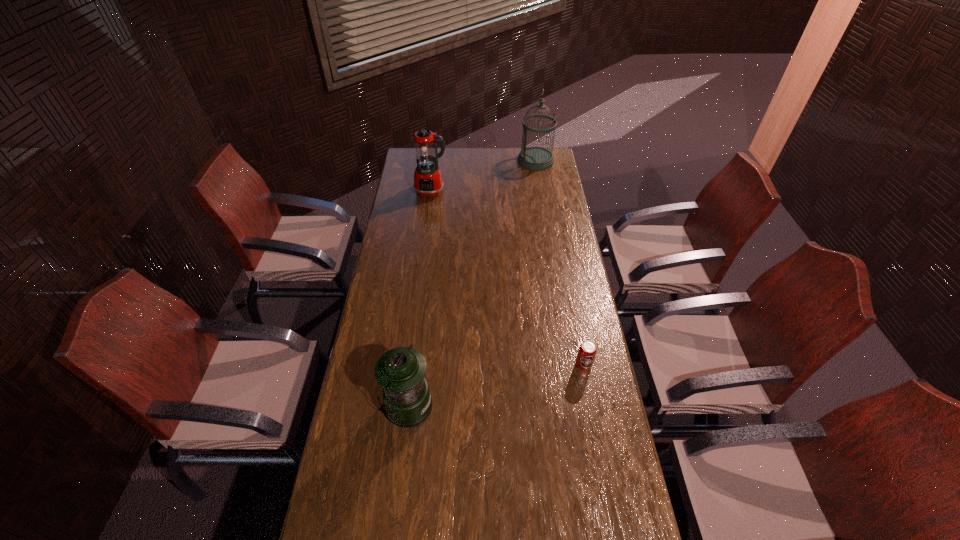
Where is `the farthest object`? The width and height of the screenshot is (960, 540). the farthest object is located at coordinates (534, 158).

Locate an element on the screen. Image resolution: width=960 pixels, height=540 pixels. the tallest object is located at coordinates (534, 158).

Locate an element on the screen. The height and width of the screenshot is (540, 960). the second tallest object is located at coordinates (428, 182).

Where is `food processor`? The width and height of the screenshot is (960, 540). food processor is located at coordinates (428, 182).

Where is `the second shortest object`? The height and width of the screenshot is (540, 960). the second shortest object is located at coordinates (401, 371).

In order to click on lantern in this screenshot , I will do `click(401, 371)`.

Identify the location of soda. point(587,350).

Identify the location of the third farthest object. (587, 350).

Locate an element on the screen. The image size is (960, 540). free space located 0.130m on the front-facing side of the tallest object is located at coordinates (494, 160).

At what (x,y) coordinates should I click in order to perform the action: click on vacant space situated 0.130m on the front-facing side of the tallest object. Please return your answer as a coordinate pair (x, y). Looking at the image, I should click on (494, 160).